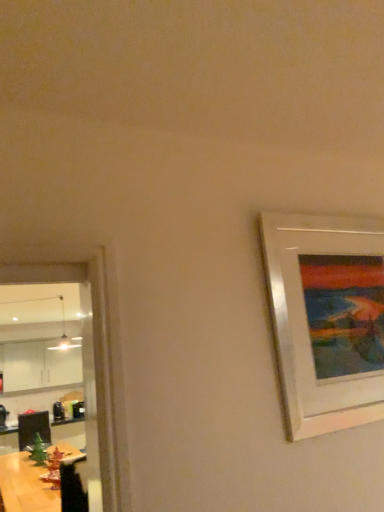
Question: Based on their sizes in the image, would you say white glossy picture frame at right is bigger or smaller than wooden table at lower left?

Choices:
 (A) small
 (B) big

Answer: (A)

Question: Is white glossy picture frame at right situated inside wooden table at lower left or outside?

Choices:
 (A) inside
 (B) outside

Answer: (B)

Question: Is point (322, 330) closer or farther from the camera than point (57, 497)?

Choices:
 (A) farther
 (B) closer

Answer: (B)

Question: Looking at their shapes, would you say wooden table at lower left is wider or thinner than white glossy picture frame at right?

Choices:
 (A) thin
 (B) wide

Answer: (B)

Question: Is point (13, 482) positioned closer to the camera than point (304, 328)?

Choices:
 (A) farther
 (B) closer

Answer: (A)

Question: Visually, is wooden table at lower left positioned to the left or to the right of white glossy picture frame at right?

Choices:
 (A) left
 (B) right

Answer: (A)

Question: Is wooden table at lower left spatially inside white glossy picture frame at right, or outside of it?

Choices:
 (A) inside
 (B) outside

Answer: (B)